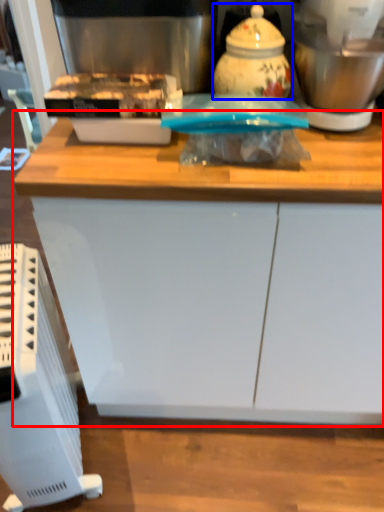
Question: Which object appears farthest to the camera in this image, cabinetry (highlighted by a red box) or kitchen appliance (highlighted by a blue box)?

Choices:
 (A) cabinetry
 (B) kitchen appliance

Answer: (B)